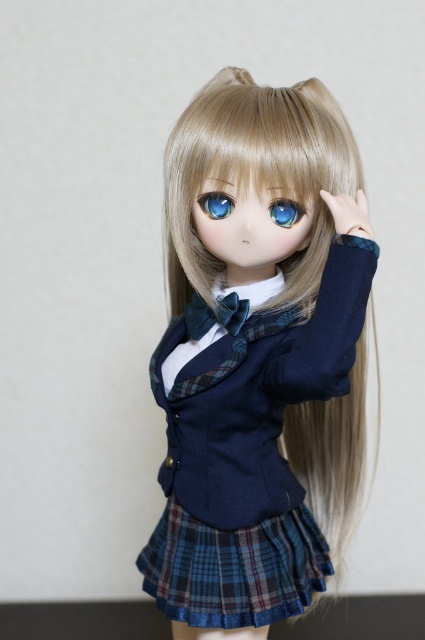
Question: Can you confirm if plaid fabric skirt at center is positioned below blue glossy eye at center?

Choices:
 (A) no
 (B) yes

Answer: (B)

Question: Among these points, which one is farthest from the camera?

Choices:
 (A) (292, 208)
 (B) (334, 333)

Answer: (A)

Question: Which object is closer to the camera taking this photo?

Choices:
 (A) blonde silky hair at center
 (B) navy blue fabric jacket at center
 (C) blue glossy eye at upper center
 (D) blue glossy eye at center

Answer: (B)

Question: Can you confirm if navy blue fabric jacket at center is positioned below blue glossy eye at upper center?

Choices:
 (A) yes
 (B) no

Answer: (A)

Question: Among these objects, which one is farthest from the camera?

Choices:
 (A) plaid fabric skirt at center
 (B) blonde silky hair at center
 (C) blue glossy eye at center

Answer: (A)

Question: Does navy blue fabric jacket at center appear on the right side of blue glossy eye at center?

Choices:
 (A) yes
 (B) no

Answer: (A)